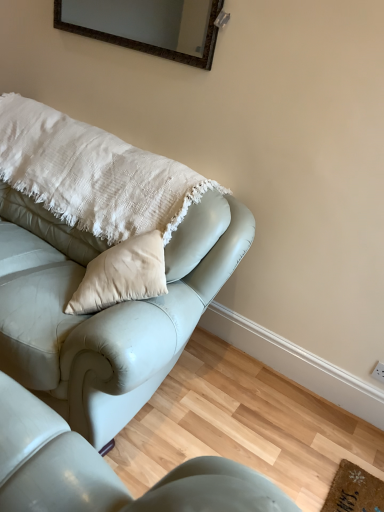
Question: From the image's perspective, does matte brown frame at upper center appear higher than matte leather couch at upper left, which appears as the 2th studio couch when ordered from the bottom?

Choices:
 (A) no
 (B) yes

Answer: (B)

Question: Is matte brown frame at upper center oriented towards matte leather couch at upper left, which appears as the first studio couch when viewed from the top?

Choices:
 (A) yes
 (B) no

Answer: (B)

Question: Does matte brown frame at upper center have a lesser height compared to matte leather couch at upper left, which appears as the 2th studio couch when ordered from the bottom?

Choices:
 (A) no
 (B) yes

Answer: (B)

Question: Is matte brown frame at upper center behind matte leather couch at upper left, which appears as the first studio couch when viewed from the top?

Choices:
 (A) yes
 (B) no

Answer: (A)

Question: Is matte brown frame at upper center not inside matte leather couch at upper left, which appears as the first studio couch when viewed from the top?

Choices:
 (A) no
 (B) yes

Answer: (B)

Question: Is matte brown frame at upper center to the left of matte leather couch at upper left, which appears as the first studio couch when viewed from the top, from the viewer's perspective?

Choices:
 (A) no
 (B) yes

Answer: (A)

Question: Is white cotton pillow at upper left positioned with its back to matte brown frame at upper center?

Choices:
 (A) no
 (B) yes

Answer: (A)

Question: Is white cotton pillow at upper left aimed at matte brown frame at upper center?

Choices:
 (A) yes
 (B) no

Answer: (B)

Question: Does white cotton pillow at upper left touch matte brown frame at upper center?

Choices:
 (A) no
 (B) yes

Answer: (A)

Question: From the image's perspective, is white cotton pillow at upper left beneath matte brown frame at upper center?

Choices:
 (A) no
 (B) yes

Answer: (B)

Question: Does white cotton pillow at upper left have a lesser width compared to matte brown frame at upper center?

Choices:
 (A) yes
 (B) no

Answer: (B)

Question: Is white cotton pillow at upper left outside of matte brown frame at upper center?

Choices:
 (A) yes
 (B) no

Answer: (A)

Question: Considering the relative positions of matte leather couch at upper left, which appears as the 2th studio couch when ordered from the bottom, and leather couch at lower left, positioned as the 1th studio couch in bottom-to-top order, in the image provided, is matte leather couch at upper left, which appears as the 2th studio couch when ordered from the bottom, to the right of leather couch at lower left, positioned as the 1th studio couch in bottom-to-top order, from the viewer's perspective?

Choices:
 (A) no
 (B) yes

Answer: (A)